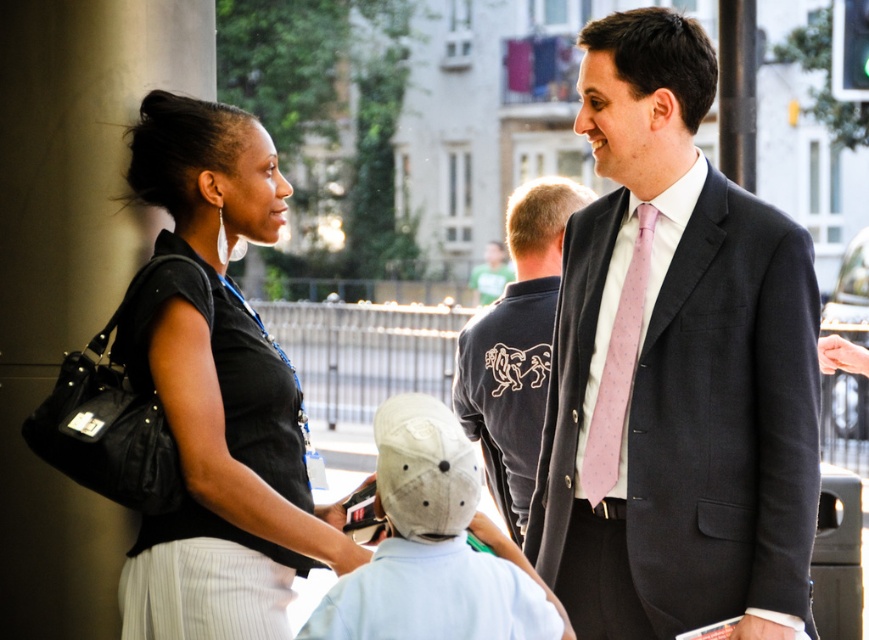
Question: Estimate the real-world distances between objects in this image. Which object is closer to the light gray cotton cap at center?

Choices:
 (A) black fabric shirt at left
 (B) dark gray suit at right
 (C) pink silk tie at right
 (D) dark blue shirt at center

Answer: (A)

Question: Can you confirm if dark gray suit at right is positioned to the left of pink silk tie at right?

Choices:
 (A) no
 (B) yes

Answer: (A)

Question: Which of the following is the farthest from the observer?

Choices:
 (A) (753, 292)
 (B) (170, 211)
 (C) (509, 602)

Answer: (B)

Question: In this image, where is dark gray suit at right located relative to light gray cotton cap at center?

Choices:
 (A) above
 (B) below

Answer: (A)

Question: Where is dark blue shirt at center located in relation to pink silk tie at right in the image?

Choices:
 (A) above
 (B) below

Answer: (B)

Question: Which point is closer to the camera?

Choices:
 (A) black fabric shirt at left
 (B) pink silk tie at right
 (C) dark blue shirt at center
 (D) light gray cotton cap at center

Answer: (D)